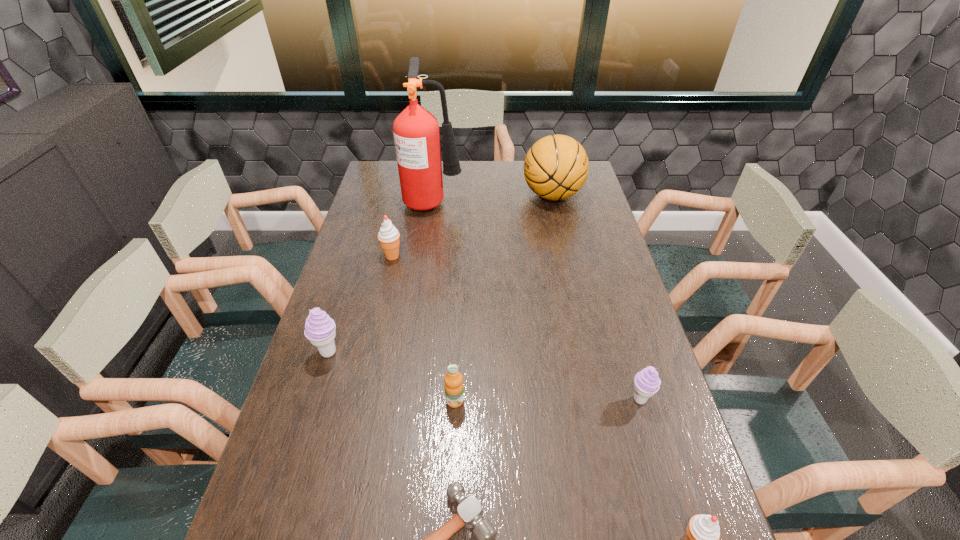
Where is `vacant space in between the orange juice and the basketball`? Image resolution: width=960 pixels, height=540 pixels. vacant space in between the orange juice and the basketball is located at coordinates (504, 298).

Locate an element on the screen. Image resolution: width=960 pixels, height=540 pixels. empty space between the orange juice and the left red icecream is located at coordinates point(423,328).

Identify the location of vacant region between the red fire extinguisher and the orange basketball. Image resolution: width=960 pixels, height=540 pixels. (492, 198).

At what (x,y) coordinates should I click in order to perform the action: click on vacant area that lies between the red fire extinguisher and the left red icecream. Please return your answer as a coordinate pair (x, y). The image size is (960, 540). Looking at the image, I should click on (413, 228).

Find the location of `object that is the sixth closest to the shortest object`. object that is the sixth closest to the shortest object is located at coordinates point(416,133).

You are a GUI agent. You are given a task and a screenshot of the screen. Output one action in this format:
    pyautogui.click(x=<x>, y=<y>)
    Task: Click on the object that is the sixth closest to the tallest object
    The image size is (960, 540).
    Given the screenshot: What is the action you would take?
    pyautogui.click(x=469, y=514)

Locate which icecream is the third closest to the orange juice. Please provide its 2D coordinates. Your answer should be formatted as a tuple, i.e. [(x, y)], where the tuple contains the x and y coordinates of a point satisfying the conditions above.

[(702, 536)]

Identify the location of icecream object that ranks as the fourth closest to the seventh shortest object. The width and height of the screenshot is (960, 540). (702, 536).

This screenshot has height=540, width=960. What are the coordinates of `vacant position in the image that satisfies the following two spatial constraints: 1. on the surface of the smaller purple icecream near the brand logo; 2. on the right side of the orange basketball` in the screenshot? It's located at (597, 399).

Locate an element on the screen. This screenshot has height=540, width=960. free region that satisfies the following two spatial constraints: 1. on the surface of the nearer purple icecream near the brand logo; 2. on the left side of the basketball is located at coordinates (597, 399).